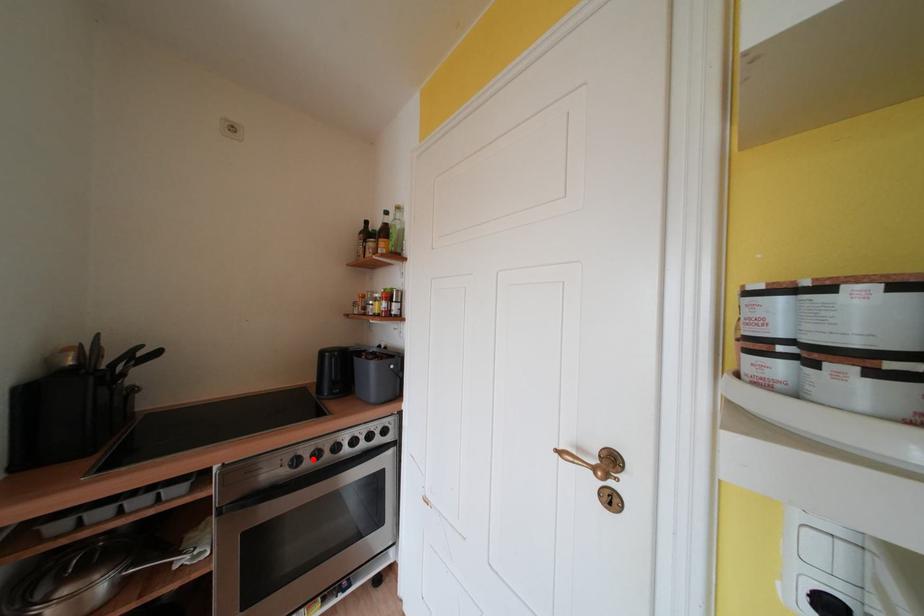
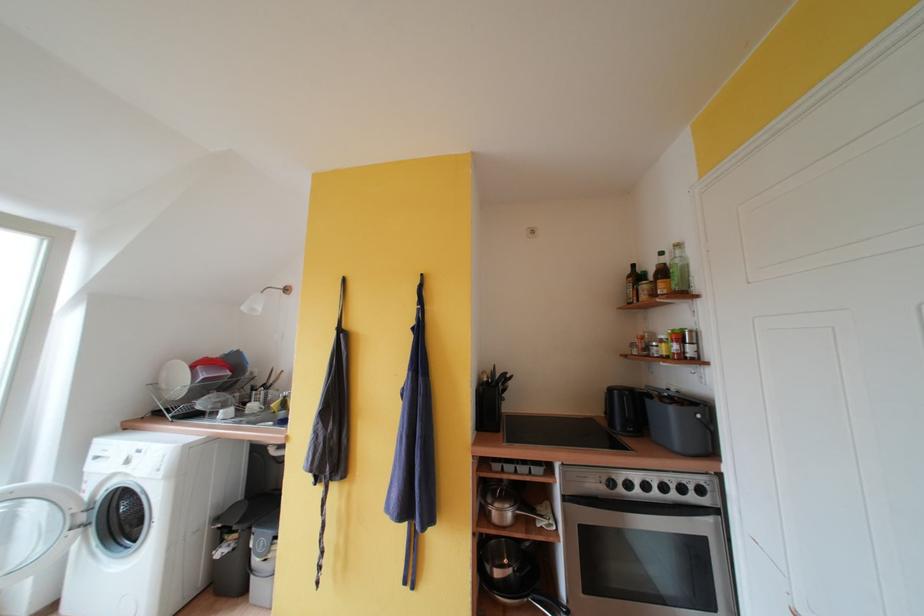
The point at the highlighted location is marked in the first image. Where is the corresponding point in the second image?

(626, 485)